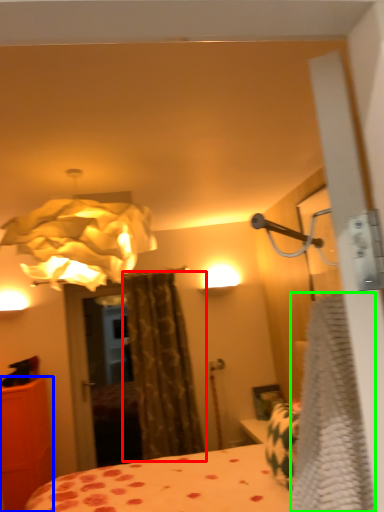
Question: Based on their relative distances, which object is farther from curtain (highlighted by a red box)? Choose from furniture (highlighted by a blue box) and blanket (highlighted by a green box).

Choices:
 (A) furniture
 (B) blanket

Answer: (B)